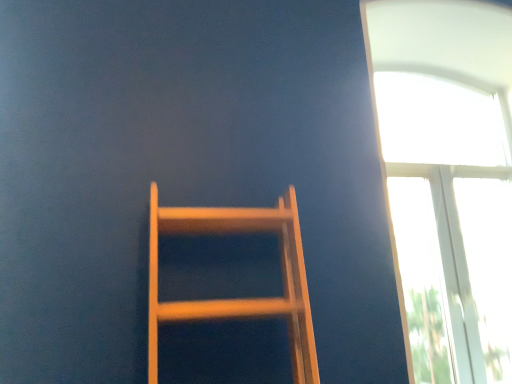
Question: From the image's perspective, is wooden ladder at center located above or below transparent glass window at upper right?

Choices:
 (A) below
 (B) above

Answer: (A)

Question: Is wooden ladder at center spatially inside transparent glass window at upper right, or outside of it?

Choices:
 (A) outside
 (B) inside

Answer: (A)

Question: Would you say wooden ladder at center is to the left or to the right of transparent glass window at upper right in the picture?

Choices:
 (A) right
 (B) left

Answer: (B)

Question: From the image's perspective, is transparent glass window at upper right above or below wooden ladder at center?

Choices:
 (A) above
 (B) below

Answer: (A)

Question: Is transparent glass window at upper right to the left or to the right of wooden ladder at center in the image?

Choices:
 (A) right
 (B) left

Answer: (A)

Question: From a real-world perspective, relative to wooden ladder at center, is transparent glass window at upper right vertically above or below?

Choices:
 (A) below
 (B) above

Answer: (B)

Question: Is transparent glass window at upper right in front of or behind wooden ladder at center in the image?

Choices:
 (A) behind
 (B) front

Answer: (A)